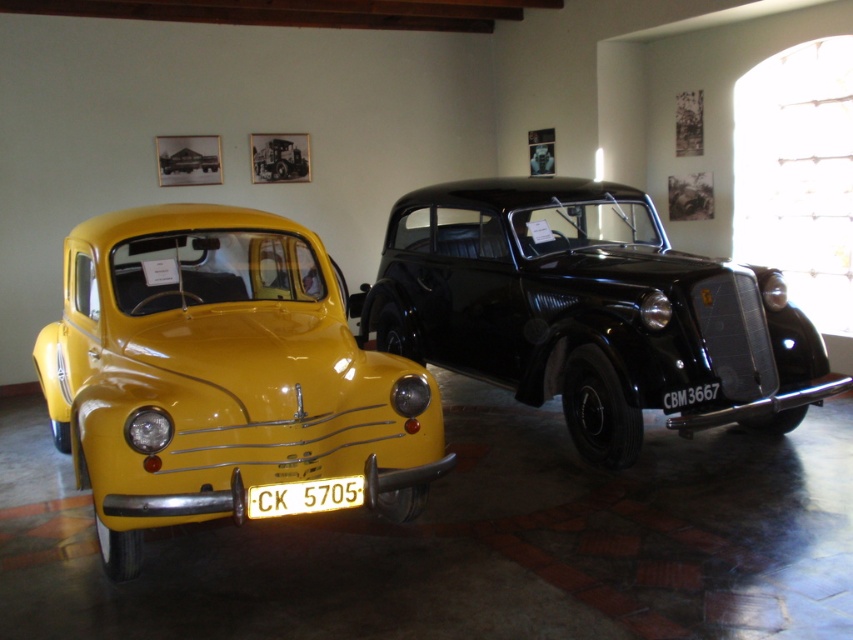
Question: Does shiny black car at center have a smaller size compared to matte yellow car at center?

Choices:
 (A) yes
 (B) no

Answer: (B)

Question: Considering the real-world distances, which object is farthest from the matte yellow car at left?

Choices:
 (A) yellow plastic license plate at center
 (B) matte yellow car at center

Answer: (B)

Question: Is shiny black car at center wider than matte yellow car at center?

Choices:
 (A) yes
 (B) no

Answer: (A)

Question: Which object appears farthest from the camera in this image?

Choices:
 (A) matte yellow car at left
 (B) yellow plastic license plate at center
 (C) matte yellow car at center
 (D) shiny black car at center

Answer: (C)

Question: Which object is closer to the camera taking this photo?

Choices:
 (A) yellow plastic license plate at center
 (B) matte yellow car at center
 (C) matte yellow car at left
 (D) shiny black car at center

Answer: (C)

Question: Where is shiny black car at center located in relation to matte yellow car at center in the image?

Choices:
 (A) right
 (B) left

Answer: (A)